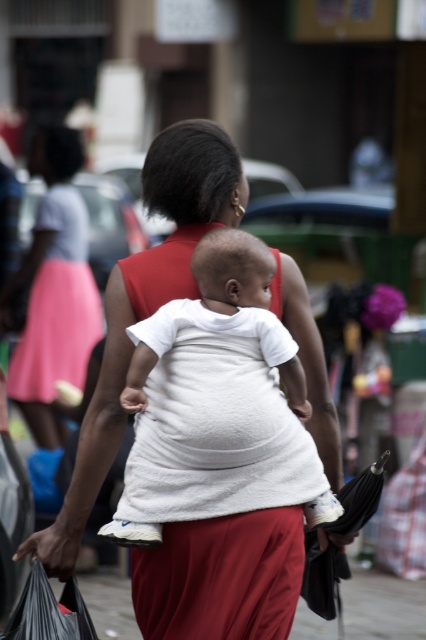
Question: Does white matte shirt at center have a greater width compared to white soft fabric baby at center?

Choices:
 (A) no
 (B) yes

Answer: (B)

Question: Considering the real-world distances, which object is closest to the white soft fabric baby at center?

Choices:
 (A) pink fabric skirt at left
 (B) white matte shirt at center

Answer: (B)

Question: Which point is closer to the camera?

Choices:
 (A) (86, 365)
 (B) (267, 394)

Answer: (B)

Question: Which object is positioned closest to the white matte shirt at center?

Choices:
 (A) pink fabric skirt at left
 (B) white soft fabric baby at center

Answer: (B)

Question: Is white matte shirt at center further to camera compared to white soft fabric baby at center?

Choices:
 (A) yes
 (B) no

Answer: (A)

Question: Is white matte shirt at center to the right of pink fabric skirt at left from the viewer's perspective?

Choices:
 (A) yes
 (B) no

Answer: (A)